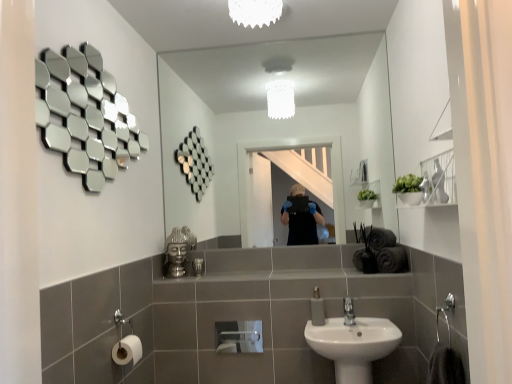
Question: From a real-world perspective, relative to metallic silver toiletry at center, is white frosted glass light fixture at upper center vertically above or below?

Choices:
 (A) above
 (B) below

Answer: (A)

Question: Is white frosted glass light fixture at upper center to the left or to the right of metallic silver toiletry at center in the image?

Choices:
 (A) right
 (B) left

Answer: (A)

Question: Estimate the real-world distances between objects in this image. Which object is farther from the white ceramic sink at lower center?

Choices:
 (A) clear glass mirror at center, the second mirror viewed from the front
 (B) white matte toilet paper at lower left, the 1th toilet paper positioned from the left
 (C) metallic silver toiletry at center
 (D) silver metallic faucet at lower center
 (E) white frosted glass light fixture at upper center

Answer: (E)

Question: Which is nearer to the metallic silver toiletry at center?

Choices:
 (A) white frosted glass light fixture at upper center
 (B) white matte toilet paper at lower left, which ranks as the second toilet paper in right-to-left order
 (C) white matte toilet paper at lower left, which is the 1th toilet paper in right-to-left order
 (D) clear glass mirror at center, the first mirror viewed from the right
 (E) shiny metallic hexagons at upper left, which is the 1th mirror in left-to-right order

Answer: (B)